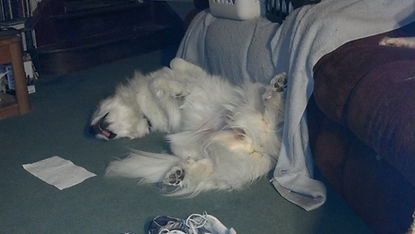
Image resolution: width=415 pixels, height=234 pixels. Identify the location of couch. 362,108.